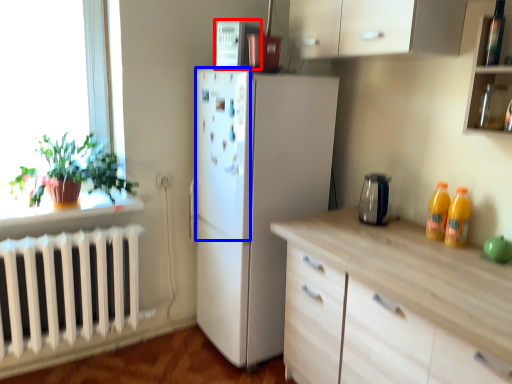
Question: Which object is closer to the camera taking this photo, appliance (highlighted by a red box) or screen door (highlighted by a blue box)?

Choices:
 (A) appliance
 (B) screen door

Answer: (B)